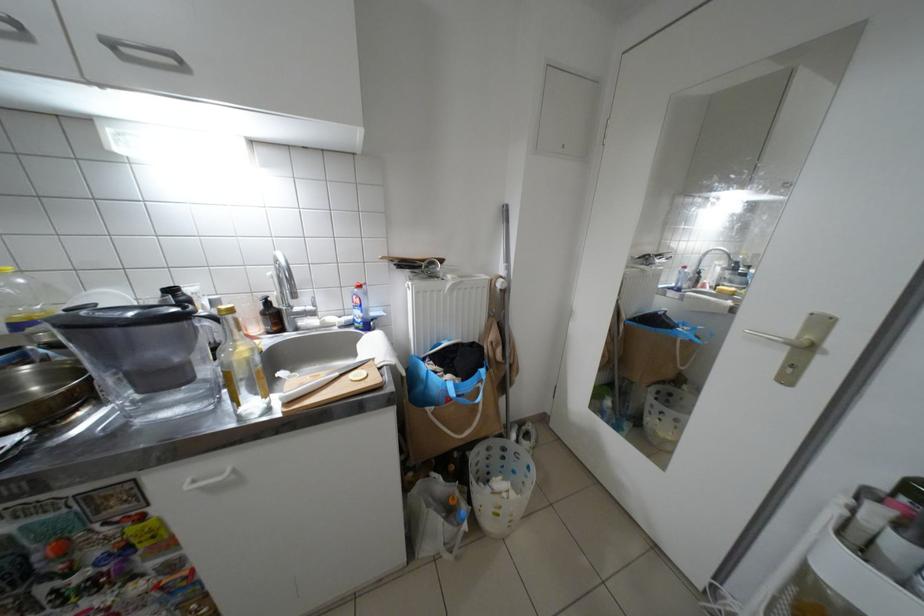
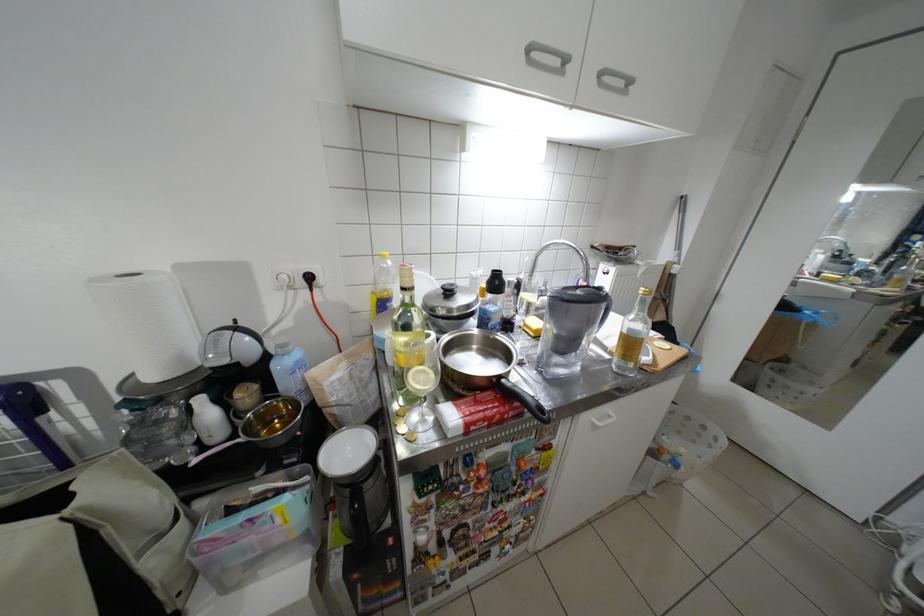
Question: Based on the continuous images, in which direction is the camera rotating? Reply with the corresponding letter.

Choices:
 (A) Left
 (B) Right
 (C) Up
 (D) Down

Answer: (D)